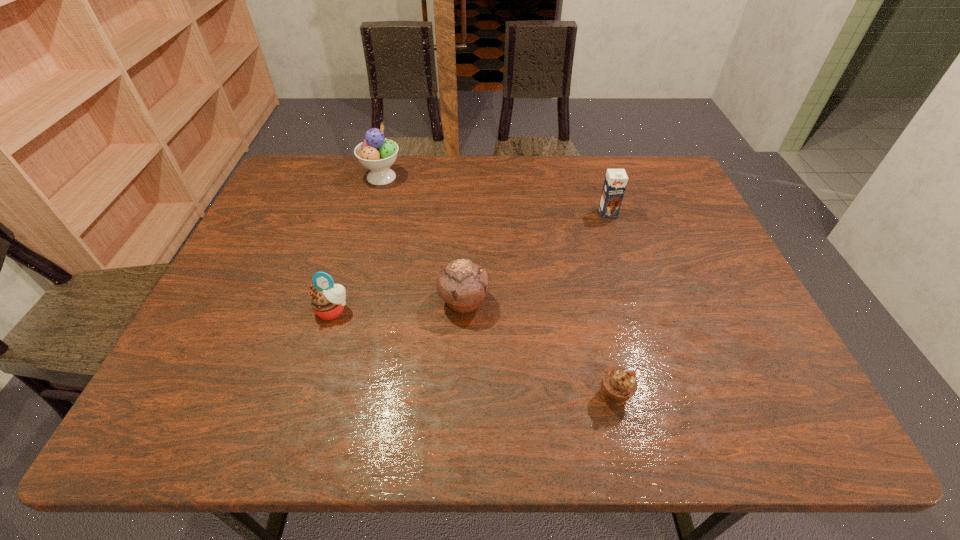
You are a GUI agent. You are given a task and a screenshot of the screen. Output one action in this format:
    pyautogui.click(x=<x>, y=<y>)
    Task: Click on the vacant space that's between the fourth nearest object and the icecream
    This screenshot has height=540, width=960.
    Given the screenshot: What is the action you would take?
    pyautogui.click(x=494, y=195)

Find the location of a particular element. This screenshot has height=540, width=960. empty space that is in between the rightmost muffin and the second muffin from right to left is located at coordinates (539, 348).

Find the location of a particular element. unoccupied position between the nearest muffin and the icecream is located at coordinates (497, 286).

The height and width of the screenshot is (540, 960). I want to click on free space between the fourth object from left to right and the third object from left to right, so click(539, 348).

Where is `free space between the chocolate milk and the farthest object`? free space between the chocolate milk and the farthest object is located at coordinates (494, 195).

Locate an element on the screen. Image resolution: width=960 pixels, height=540 pixels. free area in between the farthest object and the second muffin from right to left is located at coordinates (422, 239).

In order to click on vacant area that lies between the nearest muffin and the chocolate milk in this screenshot , I will do `click(611, 304)`.

The height and width of the screenshot is (540, 960). Find the location of `vacant area between the farthest object and the third object from right to left`. vacant area between the farthest object and the third object from right to left is located at coordinates (422, 239).

In order to click on vacant area that lies between the nearest object and the leftmost muffin in this screenshot , I will do `click(473, 353)`.

At what (x,y) coordinates should I click in order to perform the action: click on the third closest object to the icecream. Please return your answer as a coordinate pair (x, y). Image resolution: width=960 pixels, height=540 pixels. Looking at the image, I should click on (615, 182).